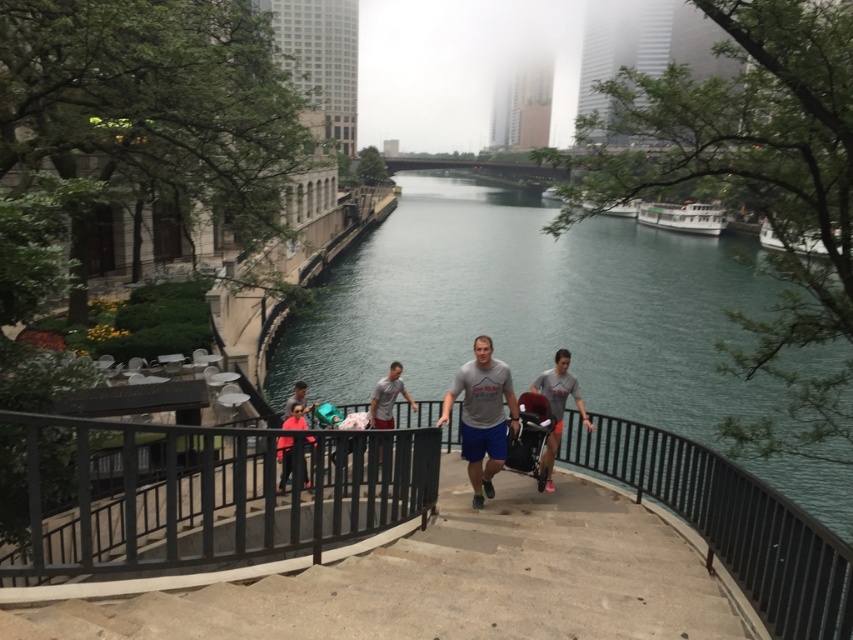
You are a person carrying a large box that is 2 meters wide. You need to walk up the concrete stairs at center while avoiding the black metal balustrade at center. Is there enough space for you to pass through the stairs without touching the balustrade?

The concrete stairs at center is wider than the black metal balustrade at center. Since the stairs are wider, there should be enough space for you to carry the 2m wide box and pass through without touching the balustrade.

You are standing on the promenade and want to take a photo of the clear blue water at center and the white matte boat at right. Which object should you focus on first if you want to capture both in the same frame without moving your camera?

You should focus on the clear blue water at center first because it is above the white matte boat at right, so adjusting the camera to include the upper part will naturally include the lower positioned boat in the frame.